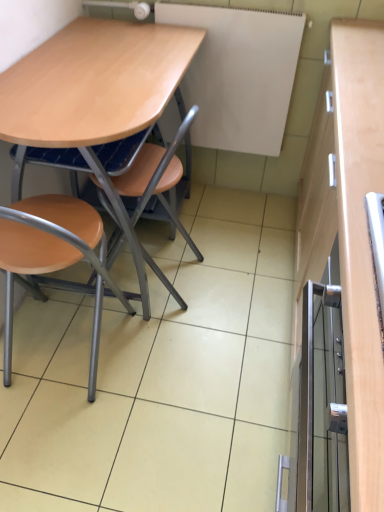
Identify the location of vacant space situated above white matte board at upper center (from a real-world perspective). (254, 2).